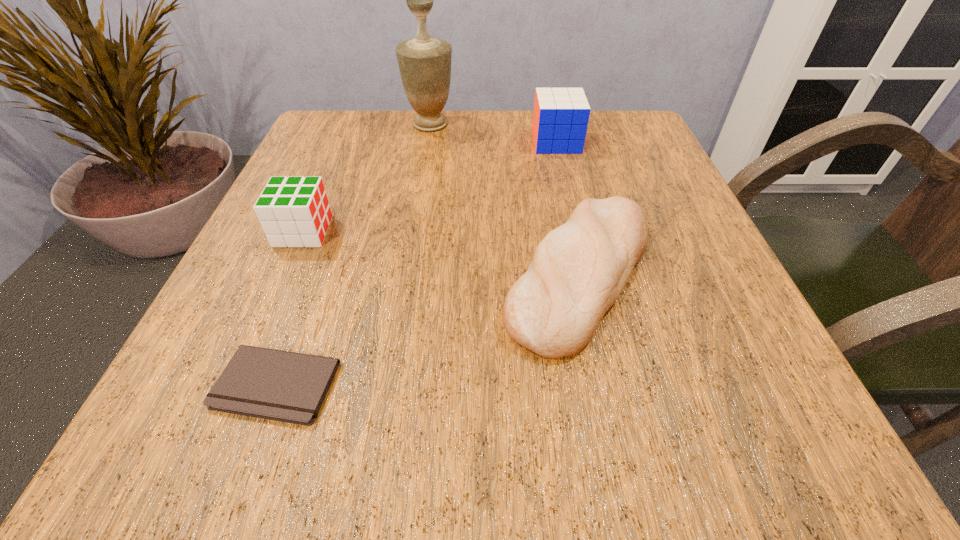
Where is `unoccupied position between the nearer cube and the third object from right to left`? This screenshot has height=540, width=960. unoccupied position between the nearer cube and the third object from right to left is located at coordinates (367, 178).

Find the location of `vacant area between the farther cube and the third object from right to left`. vacant area between the farther cube and the third object from right to left is located at coordinates (493, 133).

The width and height of the screenshot is (960, 540). What are the coordinates of `free space between the bread and the shortest object` in the screenshot? It's located at (428, 330).

The height and width of the screenshot is (540, 960). In order to click on vacant space that's between the left cube and the bread in this screenshot , I will do `click(442, 253)`.

The height and width of the screenshot is (540, 960). Find the location of `vacant area between the fourth shortest object and the left cube`. vacant area between the fourth shortest object and the left cube is located at coordinates (430, 187).

This screenshot has width=960, height=540. Find the location of `unoccupied position between the shorter cube and the bread`. unoccupied position between the shorter cube and the bread is located at coordinates (442, 253).

I want to click on free spot between the urn and the shorter cube, so click(367, 178).

I want to click on free spot between the nearer cube and the checkbook, so click(x=290, y=308).

Identify which object is located as the nearest to the bread. Please provide its 2D coordinates. Your answer should be formatted as a tuple, i.e. [(x, y)], where the tuple contains the x and y coordinates of a point satisfying the conditions above.

[(560, 119)]

You are a GUI agent. You are given a task and a screenshot of the screen. Output one action in this format:
    pyautogui.click(x=<x>, y=<y>)
    Task: Click on the object that is the fourth closest one to the bread
    The height and width of the screenshot is (540, 960).
    Given the screenshot: What is the action you would take?
    (x=295, y=212)